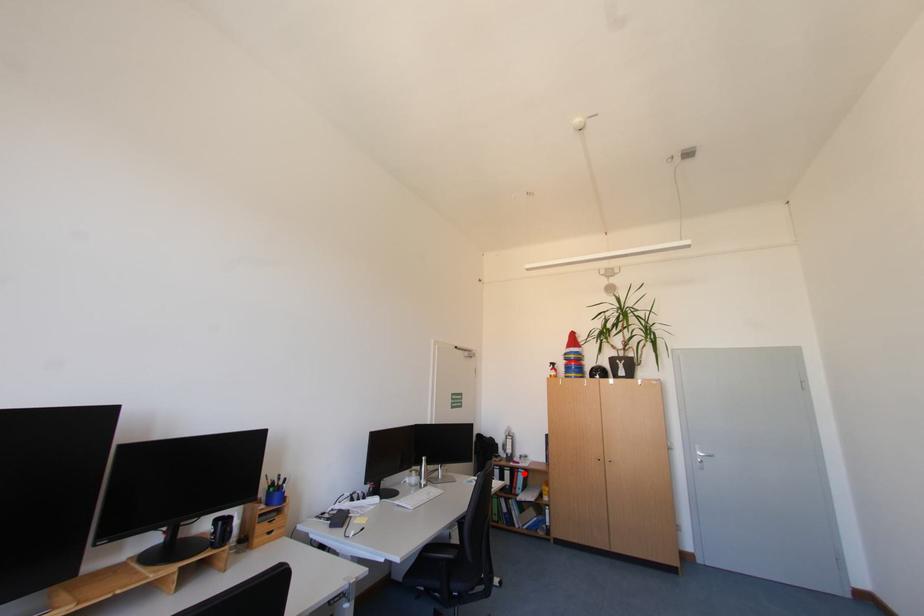
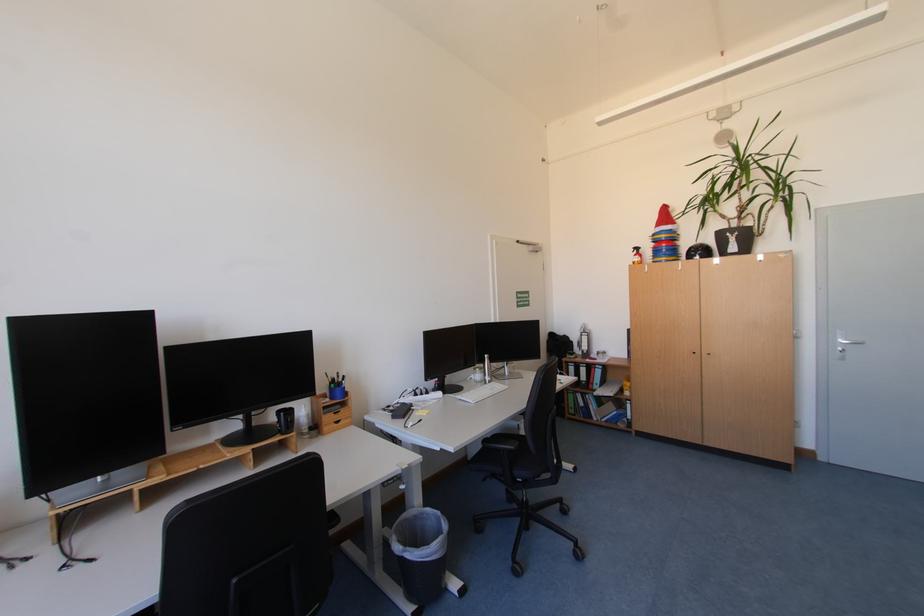
Question: A red point is marked in image1. In image2, is the corresponding 3D point closer to the camera or farther? Reply with the corresponding letter.

Choices:
 (A) The corresponding 3D point is closer.
 (B) The corresponding 3D point is farther.

Answer: (A)